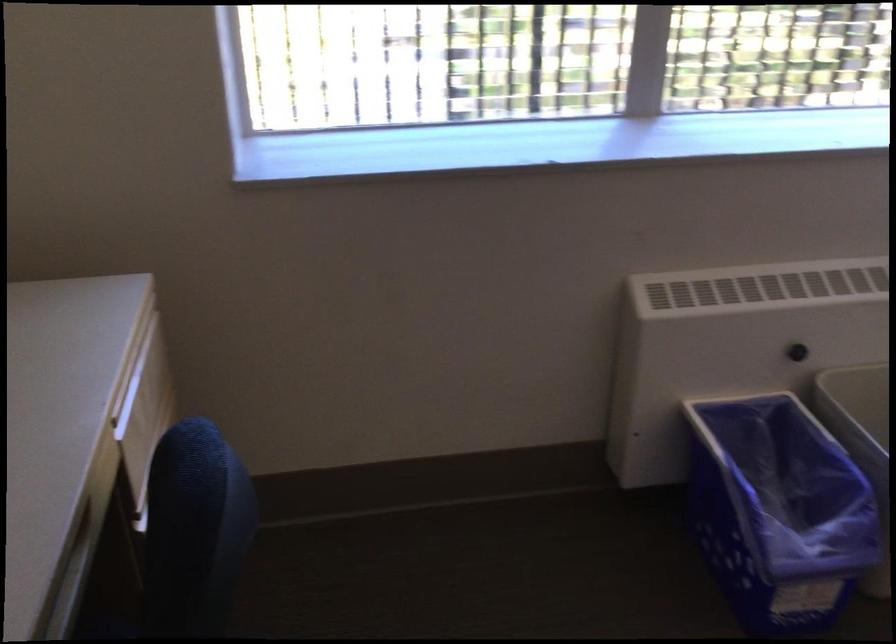
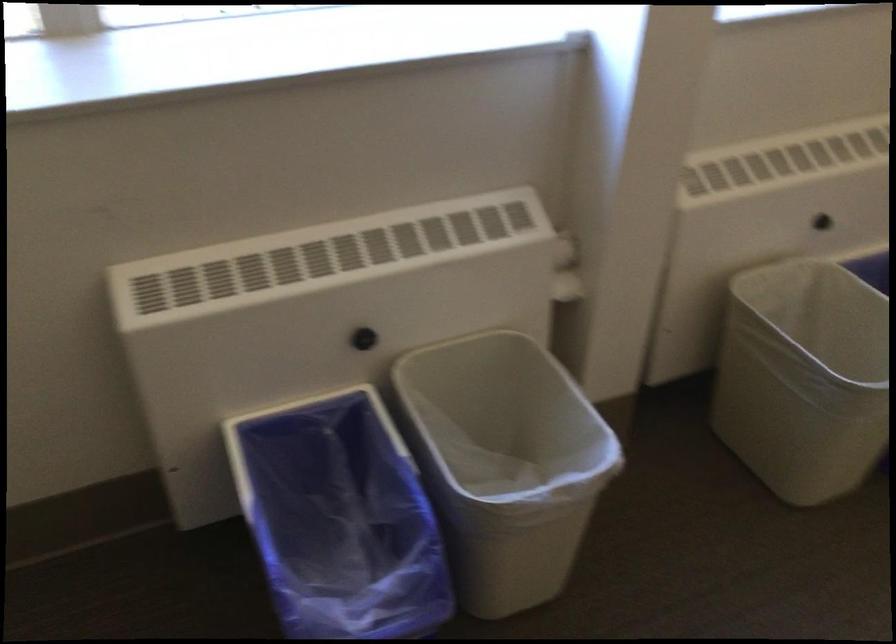
Question: How did the camera likely rotate?

Choices:
 (A) Left
 (B) Right
 (C) Up
 (D) Down

Answer: (D)